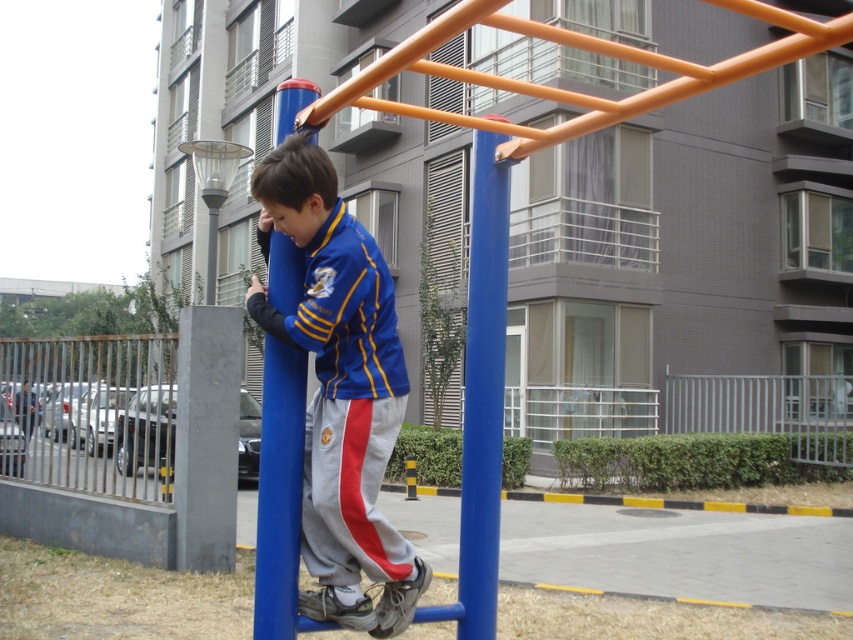
You are a parent at the playground. You see your child wearing the blue fabric jacket at center and holding onto the blue plastic pole at center. You want to hand them a water bottle. Which object should you aim for to reach them?

The blue fabric jacket at center is much taller than the blue plastic pole at center, so you should aim for the blue fabric jacket at center to reach your child.

You are a parent trying to ensure your child stays safe while playing on the playground. The child is wearing a blue fabric jacket at center and holding onto a blue plastic pole at center. Based on their sizes, could the jacket potentially interfere with the child gripping the pole securely?

The blue fabric jacket at center might be wider than blue plastic pole at center, so there is a possibility that the jacket could interfere with the child gripping the pole securely.